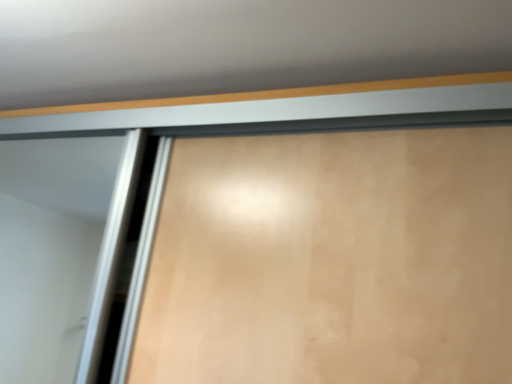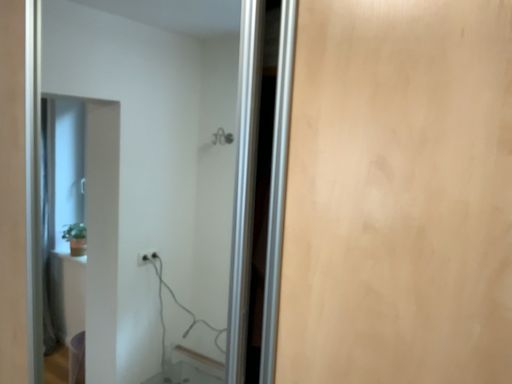
Question: How did the camera likely rotate when shooting the video?

Choices:
 (A) rotated left
 (B) rotated right

Answer: (A)